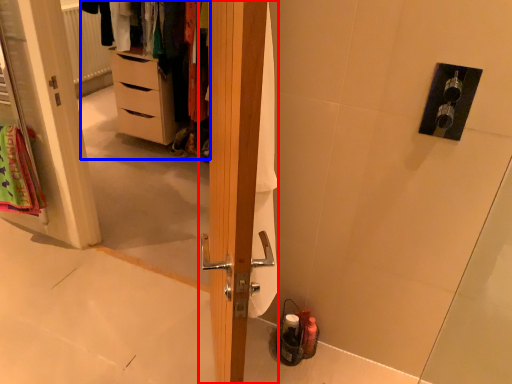
Question: Among these objects, which one is nearest to the camera, door (highlighted by a red box) or dresser (highlighted by a blue box)?

Choices:
 (A) door
 (B) dresser

Answer: (A)